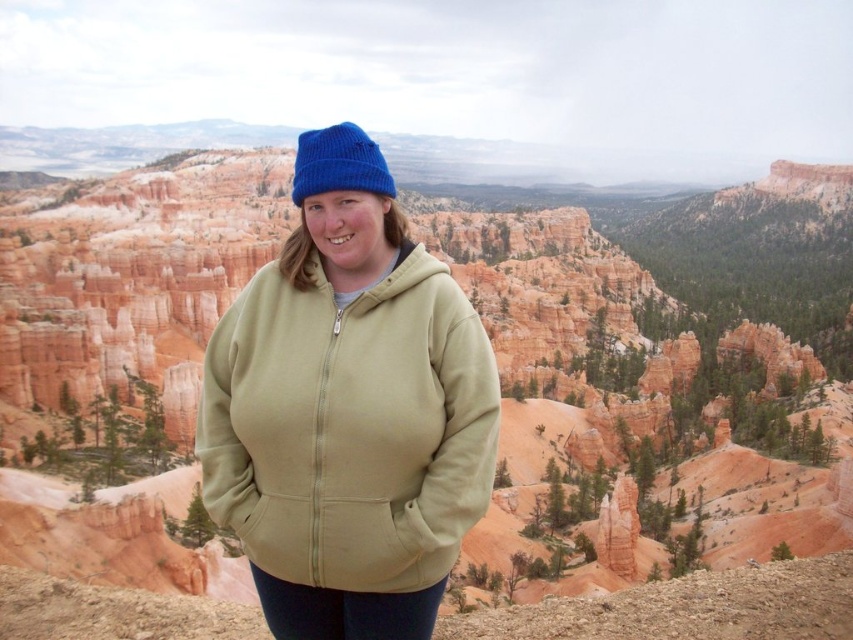
Can you confirm if sage green fleece jacket at center is positioned below blue knitted beanie at upper center?

Yes.

Between sage green fleece jacket at center and blue knitted beanie at upper center, which one has more height?

With more height is blue knitted beanie at upper center.

Between point (355, 545) and point (299, 154), which one is positioned in front?

Point (355, 545) is more forward.

Locate an element on the screen. The width and height of the screenshot is (853, 640). sage green fleece jacket at center is located at coordinates (349, 426).